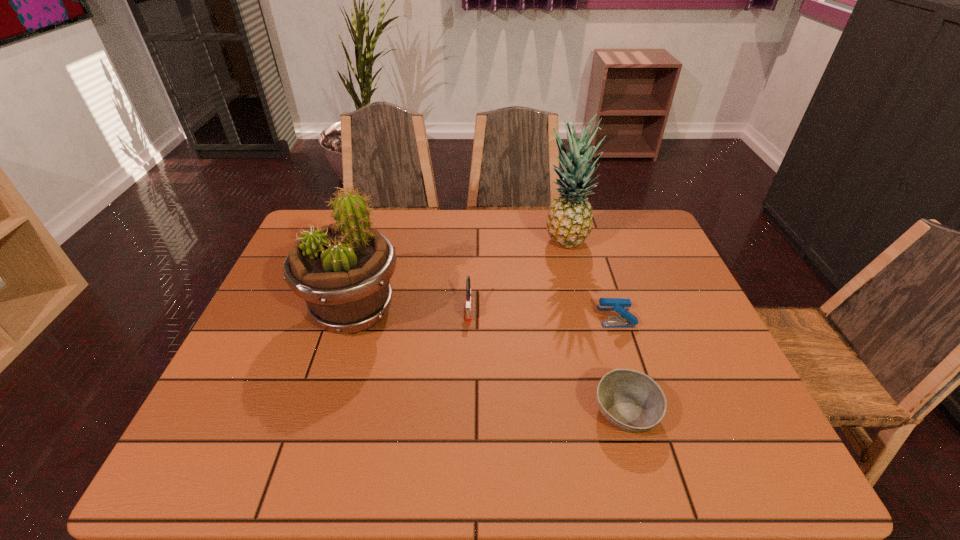
Locate an element on the screen. The width and height of the screenshot is (960, 540). pineapple is located at coordinates (569, 222).

Where is `flowerpot`? flowerpot is located at coordinates (342, 271).

This screenshot has width=960, height=540. Find the location of `the second object from left to right`. the second object from left to right is located at coordinates (468, 314).

Where is `the taller stapler`? the taller stapler is located at coordinates (468, 314).

Find the location of a particular element. the right stapler is located at coordinates (627, 320).

Find the location of a particular element. The width and height of the screenshot is (960, 540). the shorter stapler is located at coordinates (627, 320).

This screenshot has height=540, width=960. I want to click on bowl, so [630, 400].

Where is `the nearest object`? the nearest object is located at coordinates (630, 400).

Identify the location of free space located on the right of the farthest object. (656, 244).

At what (x,y) coordinates should I click in order to perform the action: click on free space located 0.290m on the front of the leftmost object. Please return your answer as a coordinate pair (x, y). The height and width of the screenshot is (540, 960). Looking at the image, I should click on (305, 471).